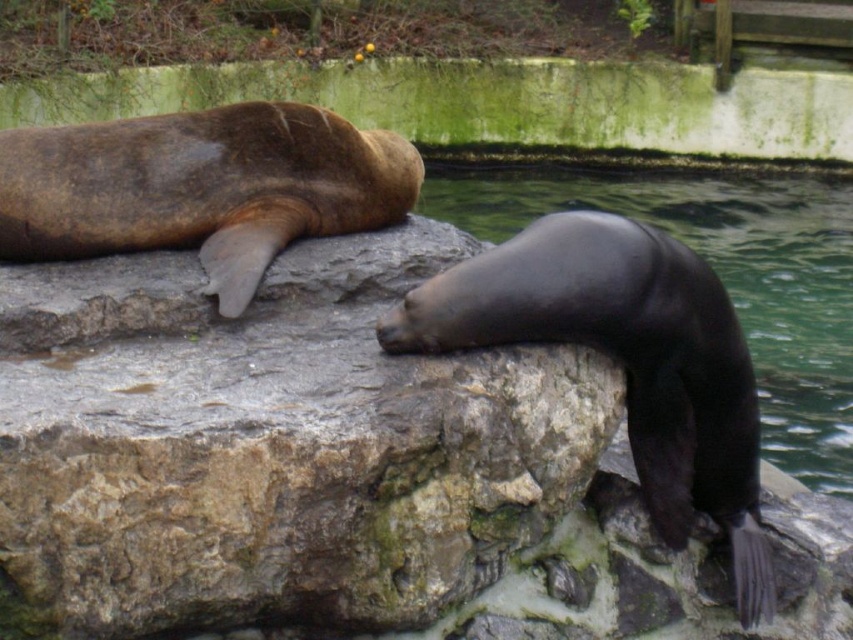
Question: Can you confirm if brown rough rock at center is positioned to the left of glossy black seal at right?

Choices:
 (A) no
 (B) yes

Answer: (B)

Question: Can you confirm if brown rough rock at center is positioned below glossy black seal at right?

Choices:
 (A) no
 (B) yes

Answer: (B)

Question: In this image, where is brown rough rock at center located relative to glossy black seal at right?

Choices:
 (A) left
 (B) right

Answer: (A)

Question: Which of the following is the closest to the observer?

Choices:
 (A) (70, 401)
 (B) (724, 262)

Answer: (A)